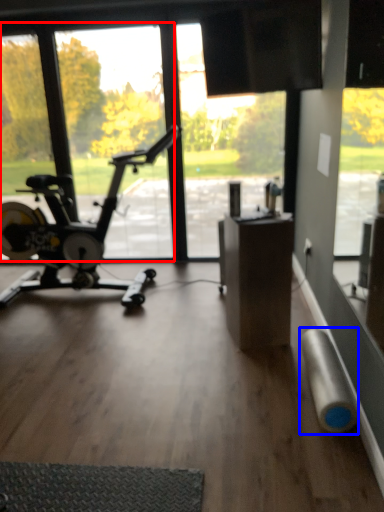
Question: Which object appears closest to the camera in this image, window screen (highlighted by a red box) or duct tape (highlighted by a blue box)?

Choices:
 (A) window screen
 (B) duct tape

Answer: (B)